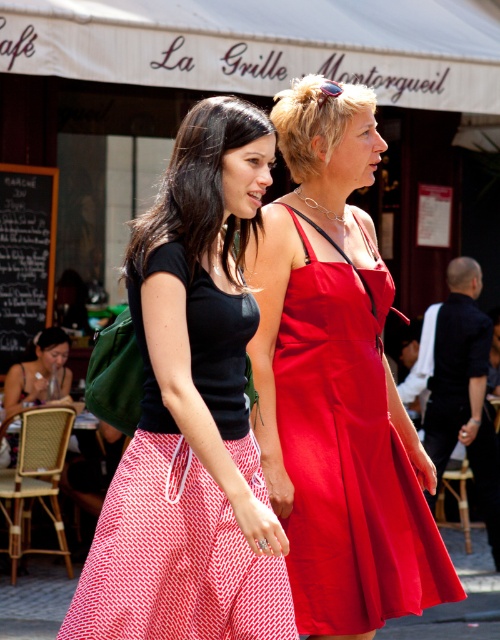
You are a photographer trying to capture a candid shot of the two women walking side by side. Your camera has a maximum focus range that can only capture objects within 80 centimeters of each other. Based on the scene, will your camera be able to focus on both the matte black top at center and the shiny satin dress at center simultaneously?

The matte black top at center and shiny satin dress at center are 81.66 centimeters apart from each other. Since the camera can only focus on objects within 80 centimeters of each other, the distance between them exceeds the maximum focus range. Therefore, the camera cannot focus on both simultaneously.

You are a photographer capturing a street scene and notice two central figures dressed in a matte black top at center and a shiny satin dress at center. Which clothing item is positioned to the left of the other?

The matte black top at center is to the left of the shiny satin dress at center.